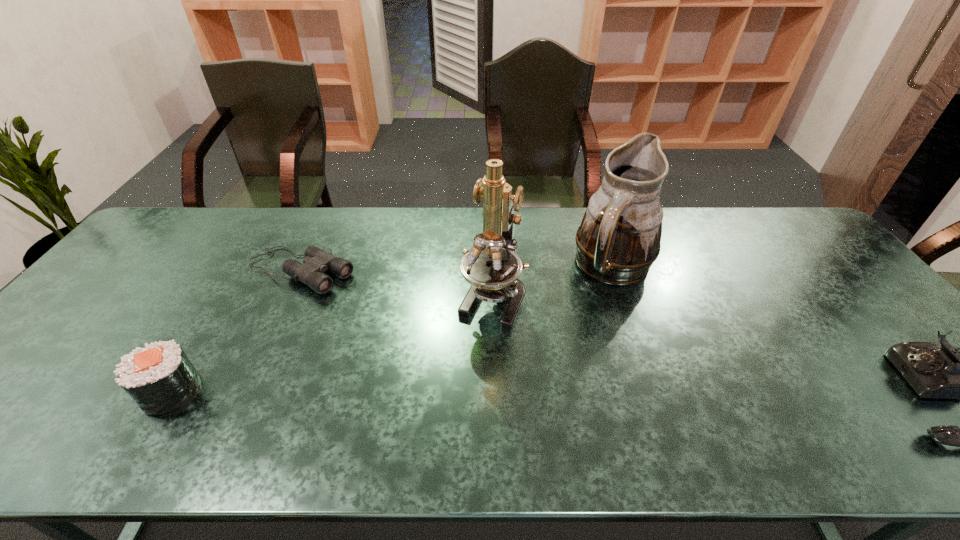
The width and height of the screenshot is (960, 540). I want to click on vacant space at the left edge, so click(x=84, y=310).

In the image, there is a desktop. In order to click on vacant space at the far right corner in this screenshot , I will do `click(803, 229)`.

I want to click on free space that is in between the binoculars and the third object from left to right, so click(396, 284).

Where is `vacant space that is in between the third object from right to left and the sushi`? This screenshot has height=540, width=960. vacant space that is in between the third object from right to left and the sushi is located at coordinates (332, 344).

At what (x,y) coordinates should I click in order to perform the action: click on free space that is in between the microscope and the fourth object from left to right. Please return your answer as a coordinate pair (x, y). Image resolution: width=960 pixels, height=540 pixels. Looking at the image, I should click on (553, 282).

Where is `free space between the second tallest object and the third object from left to right`? free space between the second tallest object and the third object from left to right is located at coordinates (553, 282).

This screenshot has height=540, width=960. What are the coordinates of `empty space between the third object from right to left and the fourth object from left to right` in the screenshot? It's located at tap(553, 282).

You are a GUI agent. You are given a task and a screenshot of the screen. Output one action in this format:
    pyautogui.click(x=<x>, y=<y>)
    Task: Click on the object that is the second closest one to the telephone
    The width and height of the screenshot is (960, 540).
    Given the screenshot: What is the action you would take?
    pyautogui.click(x=492, y=268)

You are a GUI agent. You are given a task and a screenshot of the screen. Output one action in this format:
    pyautogui.click(x=<x>, y=<y>)
    Task: Click on the closest object to the sushi
    
    Given the screenshot: What is the action you would take?
    pyautogui.click(x=316, y=262)

The width and height of the screenshot is (960, 540). Find the location of `free space that satisfies the following two spatial constraints: 1. on the back side of the fourth shortest object; 2. on the right side of the sushi`. free space that satisfies the following two spatial constraints: 1. on the back side of the fourth shortest object; 2. on the right side of the sushi is located at coordinates (247, 267).